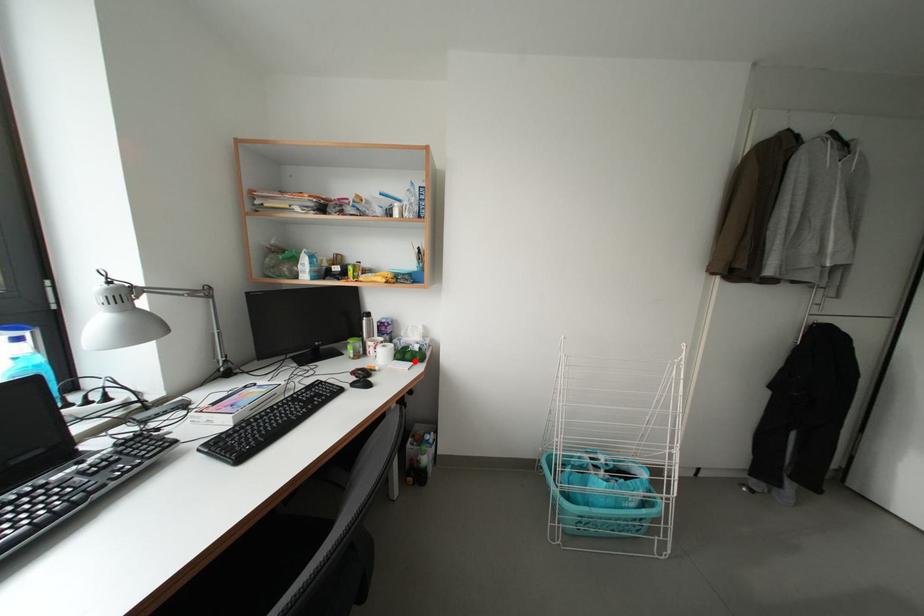
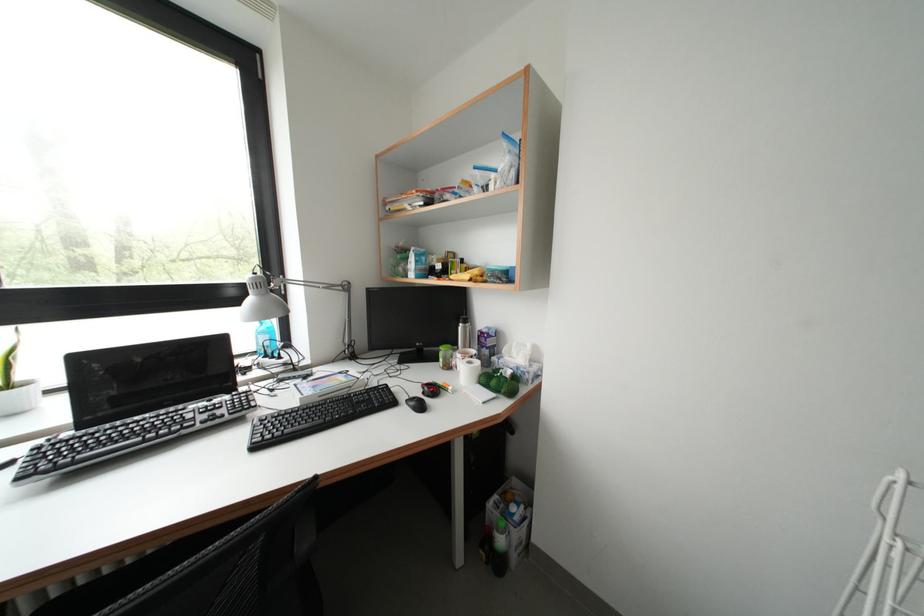
In the second image, find the point that corresponds to the highlighted location in the first image.

(500, 387)